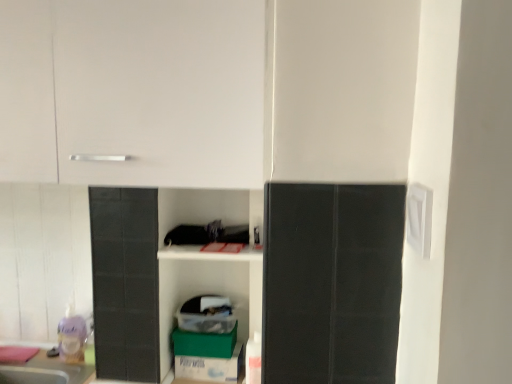
Question: In which direction should I rotate to look at green cardboard box at lower center, arranged as the second cardboard box when ordered from the bottom?

Choices:
 (A) left
 (B) right

Answer: (A)

Question: From the image's perspective, does translucent plastic toy at lower left appear lower than green cardboard box at lower center, the second cardboard box from the top?

Choices:
 (A) no
 (B) yes

Answer: (A)

Question: Considering the relative positions of translucent plastic toy at lower left and green cardboard box at lower center, the second cardboard box from the top, in the image provided, is translucent plastic toy at lower left to the right of green cardboard box at lower center, the second cardboard box from the top, from the viewer's perspective?

Choices:
 (A) no
 (B) yes

Answer: (A)

Question: Is translucent plastic toy at lower left next to green cardboard box at lower center, the second cardboard box from the top?

Choices:
 (A) yes
 (B) no

Answer: (B)

Question: Does translucent plastic toy at lower left have a lesser width compared to green cardboard box at lower center, positioned as the first cardboard box in bottom-to-top order?

Choices:
 (A) no
 (B) yes

Answer: (B)

Question: Considering the relative sizes of translucent plastic toy at lower left and green cardboard box at lower center, positioned as the first cardboard box in bottom-to-top order, in the image provided, is translucent plastic toy at lower left taller than green cardboard box at lower center, positioned as the first cardboard box in bottom-to-top order,?

Choices:
 (A) no
 (B) yes

Answer: (B)

Question: Can we say translucent plastic toy at lower left lies outside green cardboard box at lower center, the second cardboard box from the top?

Choices:
 (A) yes
 (B) no

Answer: (A)

Question: Does green cardboard box at lower center, arranged as the second cardboard box when ordered from the bottom, have a greater width compared to white matte cabinet at upper left?

Choices:
 (A) no
 (B) yes

Answer: (A)

Question: Is green cardboard box at lower center, the first cardboard box when ordered from top to bottom, positioned beyond the bounds of white matte cabinet at upper left?

Choices:
 (A) no
 (B) yes

Answer: (B)

Question: Is green cardboard box at lower center, the first cardboard box when ordered from top to bottom, taller than white matte cabinet at upper left?

Choices:
 (A) no
 (B) yes

Answer: (A)

Question: From the image's perspective, would you say green cardboard box at lower center, arranged as the second cardboard box when ordered from the bottom, is shown under white matte cabinet at upper left?

Choices:
 (A) yes
 (B) no

Answer: (A)

Question: Could you tell me if green cardboard box at lower center, arranged as the second cardboard box when ordered from the bottom, is facing white matte cabinet at upper left?

Choices:
 (A) yes
 (B) no

Answer: (B)

Question: Is green cardboard box at lower center, arranged as the second cardboard box when ordered from the bottom, positioned before white matte cabinet at upper left?

Choices:
 (A) no
 (B) yes

Answer: (A)

Question: Considering the relative positions of white matte cabinet at upper left and translucent plastic toy at lower left in the image provided, is white matte cabinet at upper left to the right of translucent plastic toy at lower left from the viewer's perspective?

Choices:
 (A) yes
 (B) no

Answer: (A)